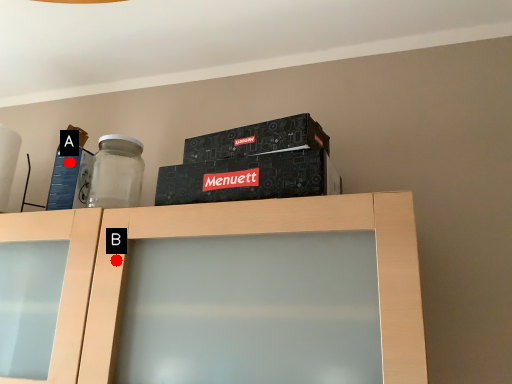
Question: Two points are circled on the image, labeled by A and B beside each circle. Among these points, which one is farthest from the camera?

Choices:
 (A) A is further
 (B) B is further

Answer: (A)